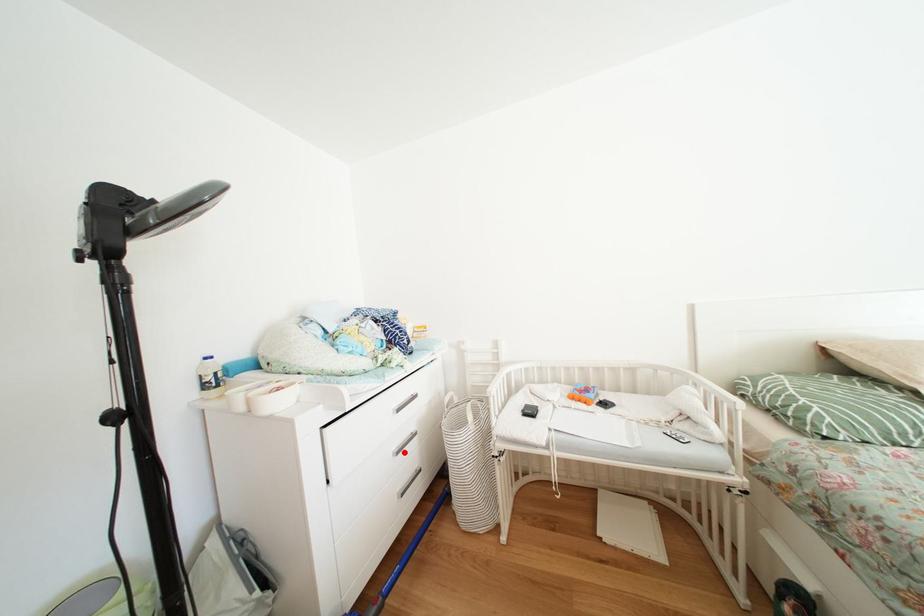
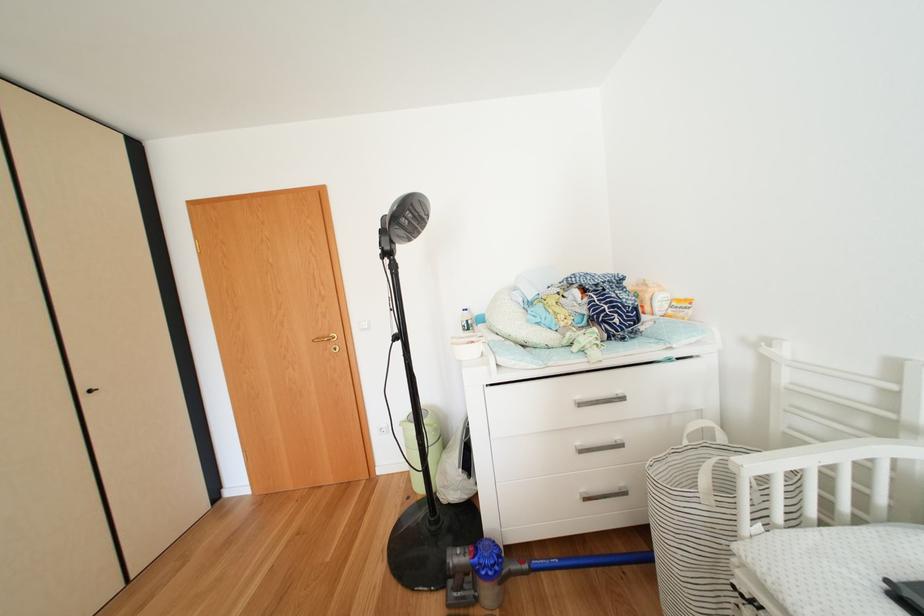
The point at the highlighted location is marked in the first image. Where is the corresponding point in the second image?

(590, 448)